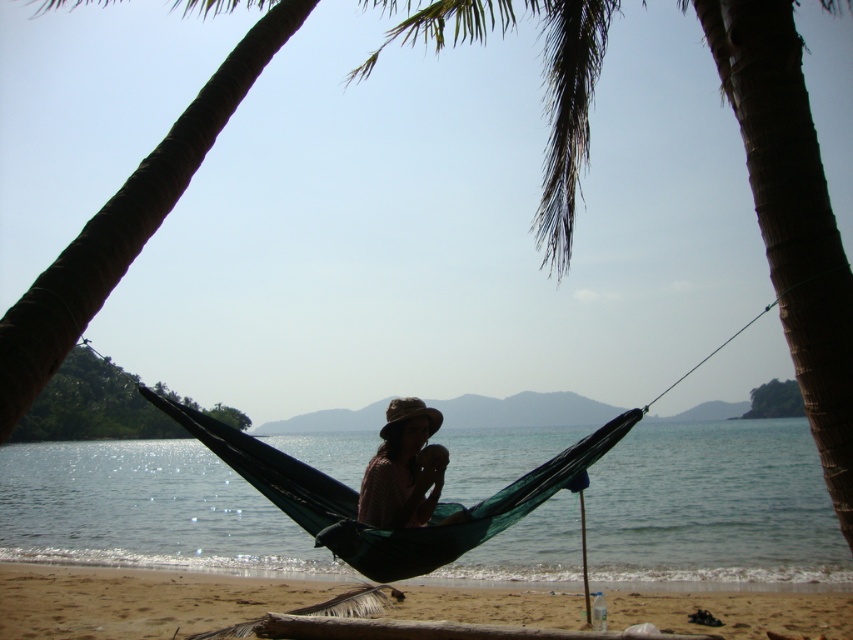
Does green water at center have a lesser width compared to plaid fabric person at center?

No, green water at center is not thinner than plaid fabric person at center.

Does green water at center have a greater height compared to plaid fabric person at center?

Yes.

I want to click on green water at center, so click(x=712, y=506).

Find the location of a particular element. Image resolution: width=853 pixels, height=640 pixels. green water at center is located at coordinates (712, 506).

How far apart are sandy beach at lower center and plaid fabric person at center?

They are 21.55 feet apart.

Does point (683, 592) lie behind point (405, 448)?

Yes, point (683, 592) is behind point (405, 448).

Does point (791, 604) lie behind point (425, 460)?

Yes, point (791, 604) is farther from viewer.

Find the location of a particular element. sandy beach at lower center is located at coordinates (138, 600).

Which of these two, green water at center or sandy beach at lower center, stands shorter?

Standing shorter between the two is sandy beach at lower center.

Looking at this image, between green water at center and sandy beach at lower center, which one appears on the left side from the viewer's perspective?

sandy beach at lower center is more to the left.

The image size is (853, 640). Find the location of `green water at center`. green water at center is located at coordinates (712, 506).